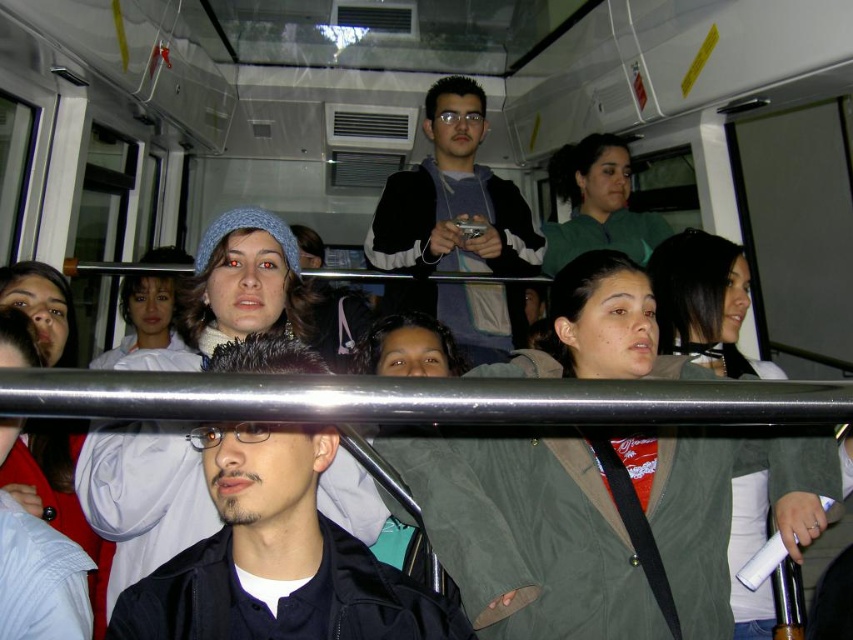
In the scene shown: You are a passenger on a crowded bus and need to exit through the door located at the front of the vehicle. You notice the dark blue jacket at center and the green matte jacket at upper center blocking your path. Which jacket is closer to you, and which one might you need to ask to move first?

The dark blue jacket at center is closer to you since it is in front of the green matte jacket at upper center. You should ask the person wearing the dark blue jacket at center to move first to clear your path.

You are a passenger on a crowded bus and need to decide which item of clothing to grab quickly. The black sweater at center and the green matte jacket at upper center are both within reach. Which one is smaller in size?

The black sweater at center has a smaller size compared to the green matte jacket at upper center, so you should grab the black sweater at center.